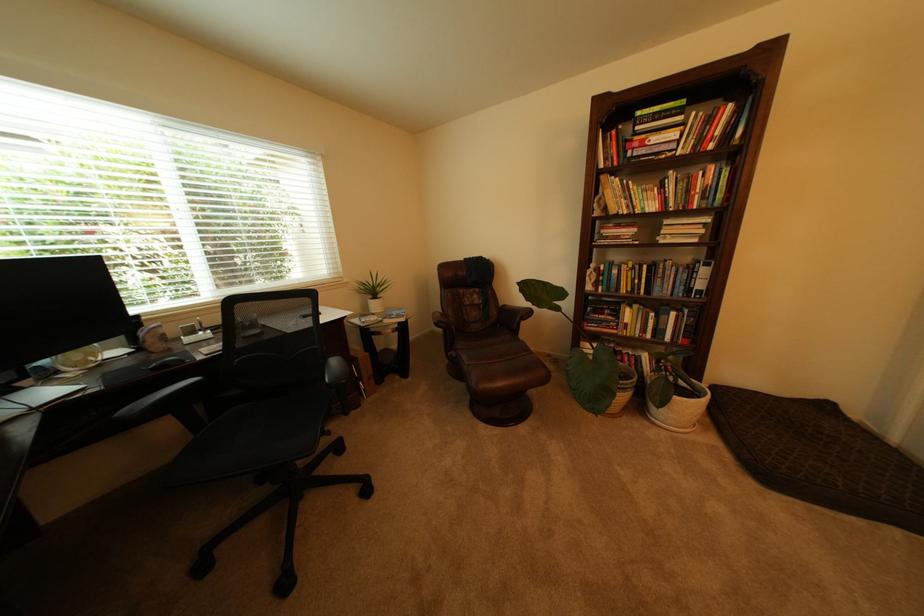
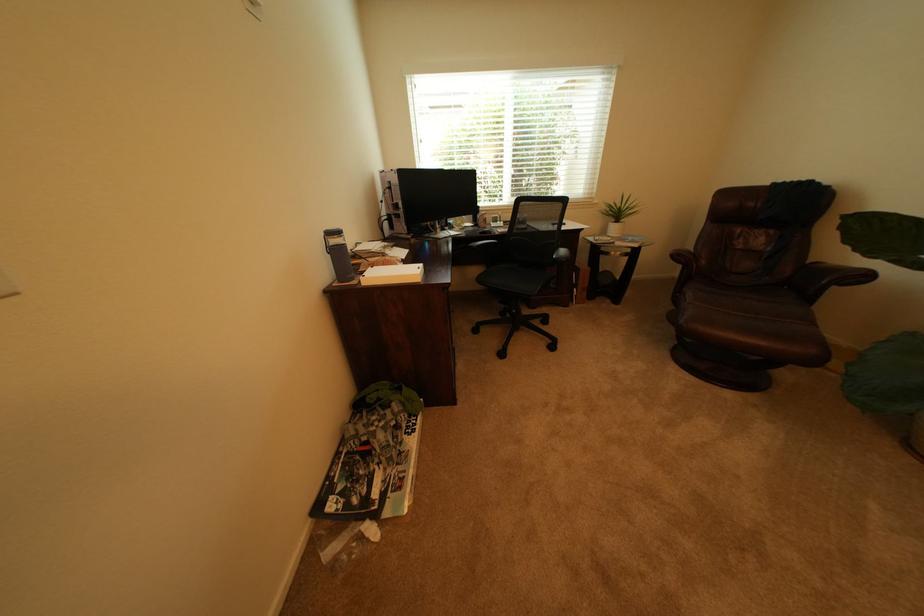
In the second image, find the point that corresponds to [455,323] in the first image.

(695, 257)